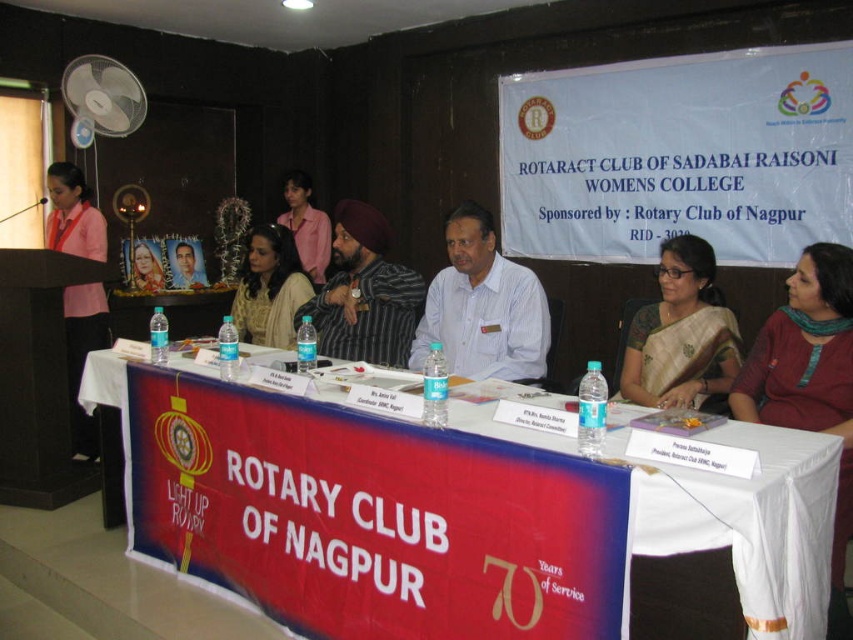
Question: Which point is farther from the camera taking this photo?

Choices:
 (A) (154, 252)
 (B) (762, 381)
 (C) (345, 301)

Answer: (A)

Question: Does golden silk saree at center appear on the left side of matte black dress at center?

Choices:
 (A) yes
 (B) no

Answer: (B)

Question: Can you confirm if golden silk saree at center is positioned to the left of matte black turban at center?

Choices:
 (A) no
 (B) yes

Answer: (A)

Question: Can you confirm if matte black turban at center is thinner than matte black photo frame at center?

Choices:
 (A) yes
 (B) no

Answer: (B)

Question: Which of these objects is positioned farthest from the golden silk saree at center?

Choices:
 (A) pink fabric at left
 (B) matte black portrait at center
 (C) red fabric banner at center

Answer: (B)

Question: Which of the following is the closest to the observer?

Choices:
 (A) (718, 328)
 (B) (271, 317)
 (C) (148, 291)

Answer: (A)